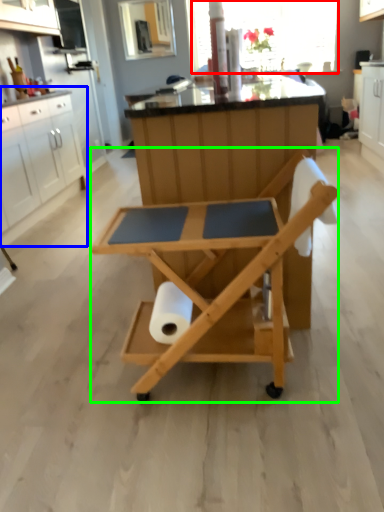
Question: Based on their relative distances, which object is farther from window screen (highlighted by a red box)? Choose from cabinetry (highlighted by a blue box) and table (highlighted by a green box).

Choices:
 (A) cabinetry
 (B) table

Answer: (B)